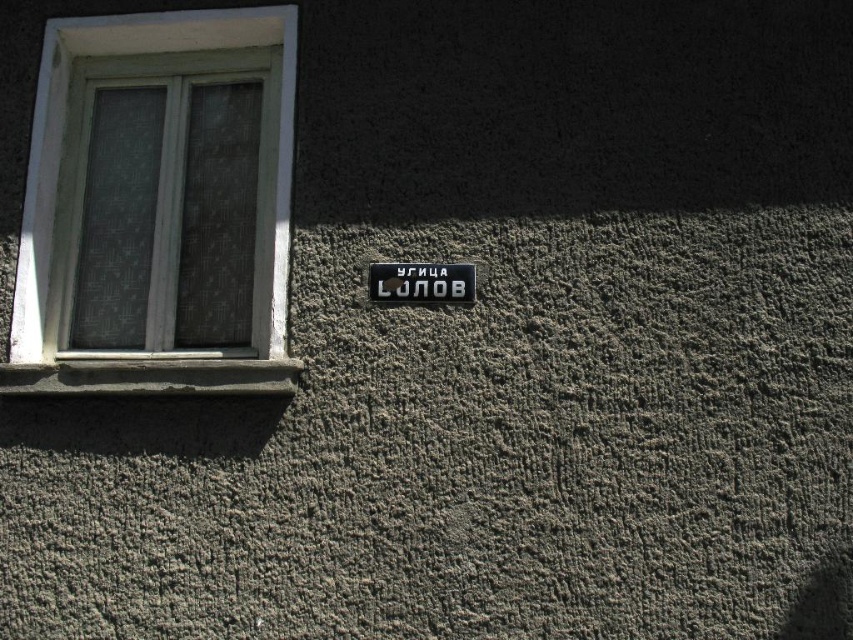
Does white plastic window at upper left have a greater height compared to black plastic sign at center?

Correct, white plastic window at upper left is much taller as black plastic sign at center.

Can you confirm if white plastic window at upper left is positioned above black plastic sign at center?

Correct, white plastic window at upper left is located above black plastic sign at center.

At what (x,y) coordinates should I click in order to perform the action: click on white plastic window at upper left. Please return your answer as a coordinate pair (x, y). Looking at the image, I should click on (157, 205).

Locate an element on the screen. The width and height of the screenshot is (853, 640). white plastic window at upper left is located at coordinates (157, 205).